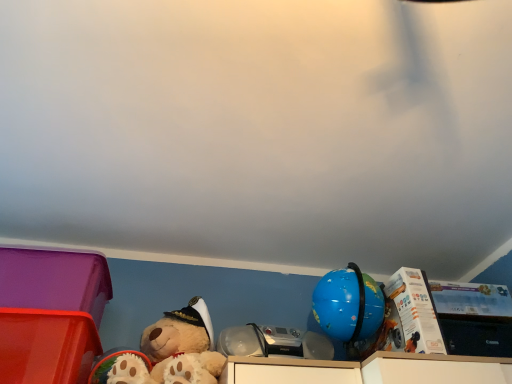
Question: Is point (473, 321) positioned closer to the camera than point (119, 372)?

Choices:
 (A) farther
 (B) closer

Answer: (A)

Question: In the image, is white cardboard box at upper right, acting as the 1th storage box starting from the right, positioned in front of or behind fluffy beige teddy bear at lower left?

Choices:
 (A) behind
 (B) front

Answer: (A)

Question: Based on their relative distances, which object is farther from the matte plastic storage box at lower left, which is the second storage box from left to right?

Choices:
 (A) matte plastic storage box at lower left, placed as the 3th storage box when sorted from right to left
 (B) white cardboard box at upper right, acting as the 1th storage box starting from the right
 (C) fluffy beige teddy bear at lower left

Answer: (B)

Question: Which object is the closest to the fluffy beige teddy bear at lower left?

Choices:
 (A) matte plastic storage box at lower left, which is the second storage box from left to right
 (B) white cardboard box at upper right, acting as the 1th storage box starting from the right
 (C) matte plastic storage box at lower left, the 1th storage box viewed from the left

Answer: (A)